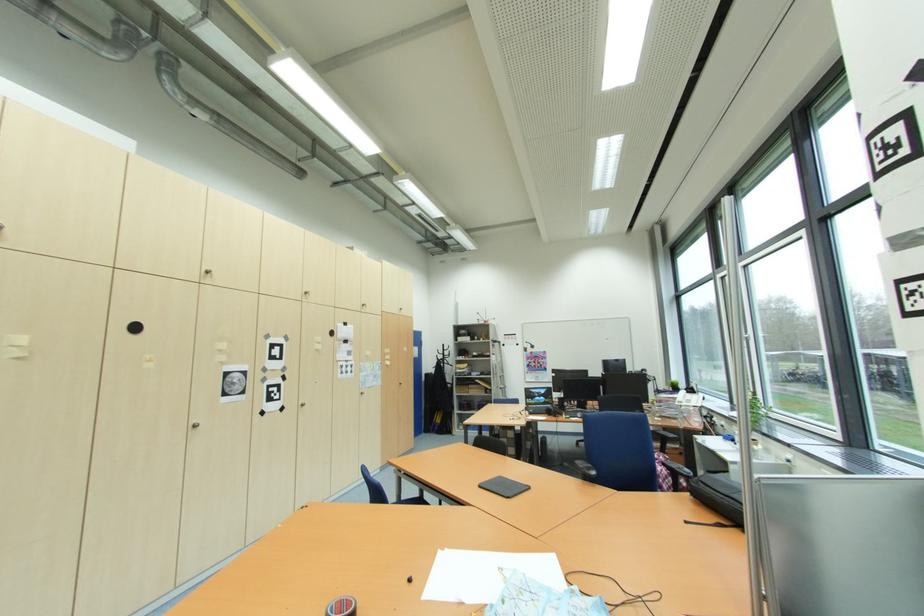
Where would you pull the silver window handle? Please return your answer as a coordinate pair (x, y).

(748, 337)